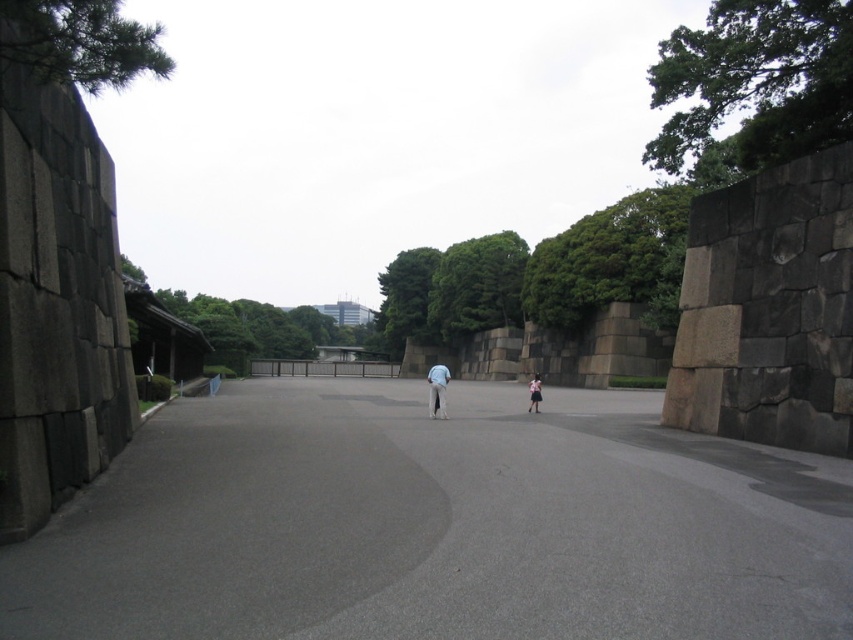
Consider the image. You are standing at the camera position and see two points in the image. One is at point [648,554] and the other is at point [531,401]. Which point is closer to you?

Point [648,554] is closer to the camera than point [531,401].

You are standing at the edge of the gray asphalt pavement at center and want to walk towards the light blue fabric at center. Which direction should you move to reach it?

The gray asphalt pavement at center is wider than the light blue fabric at center, so you should move towards the narrower area to reach the light blue fabric at center.

You are standing at the camera position looking at the paved area between the stone walls. There is a point marked at coordinates (x=437, y=388). What object or feature is located at that point?

The point at (x=437, y=388) corresponds to the light blue fabric pants at center.